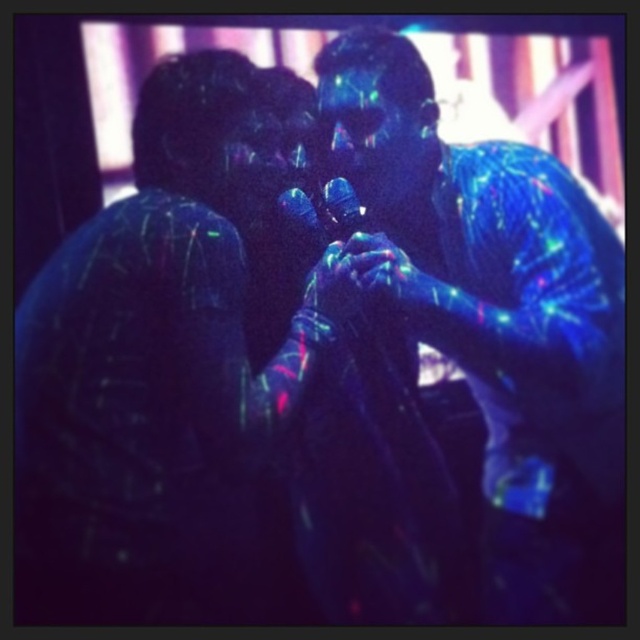
In order to click on neon blue skin at center in this screenshot , I will do `click(502, 321)`.

Which is in front, point (509, 506) or point (392, 243)?

Point (392, 243) is more forward.

Is point (522, 205) in front of point (381, 241)?

Yes.

At what (x,y) coordinates should I click in order to perform the action: click on neon blue skin at center. Please return your answer as a coordinate pair (x, y). Looking at the image, I should click on (502, 321).

Between neon plastic hand at center and translucent plastic microphone at center, which one has more height?

With more height is neon plastic hand at center.

Who is lower down, neon plastic hand at center or translucent plastic microphone at center?

neon plastic hand at center is lower down.

Does point (397, 280) come closer to viewer compared to point (312, 214)?

Yes, it is.

The height and width of the screenshot is (640, 640). I want to click on neon plastic hand at center, so click(381, 269).

Which of these two, neon blue fabric at center or neon plastic hand at center, stands taller?

With more height is neon blue fabric at center.

Describe the element at coordinates (352, 275) in the screenshot. I see `neon blue fabric at center` at that location.

Is point (337, 314) less distant than point (384, 257)?

Yes, it is in front of point (384, 257).

This screenshot has height=640, width=640. What are the coordinates of `neon blue fabric at center` in the screenshot? It's located at (352, 275).